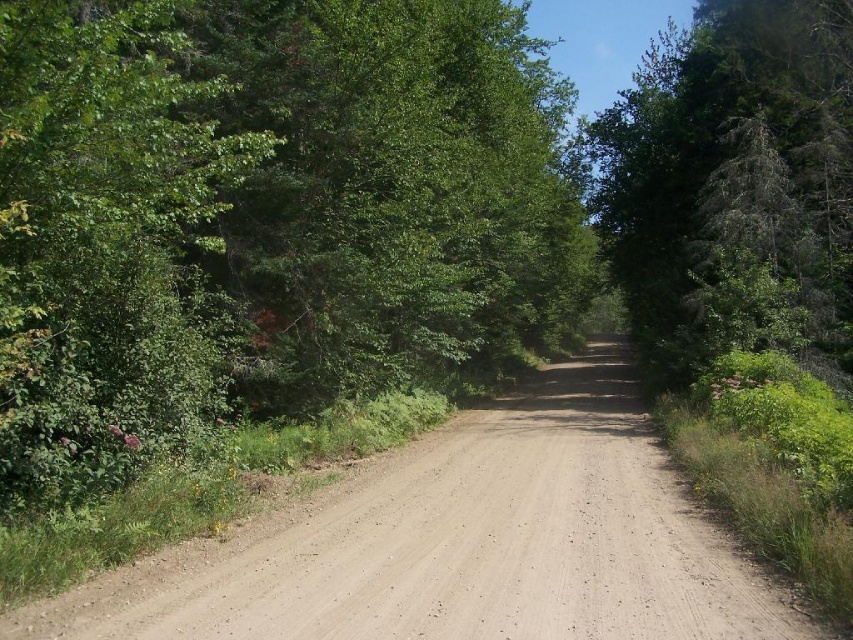
You are standing at the point marked as point (267, 218) on the dirt road. What object is located exactly at that point?

The point (267, 218) is where the green leafy tree at left is located.

You are a hiker carrying a 5.5 meter long tent pole. You need to pass through the gap between the green leafy tree at left and the nearest tree on the right side. Can your tent pole fit through the gap without bending it?

The gap between the green leafy tree at left and the nearest tree on the right side is 6.04 meters. Since the tent pole is 5.5 meters long, it can fit through the gap without bending.